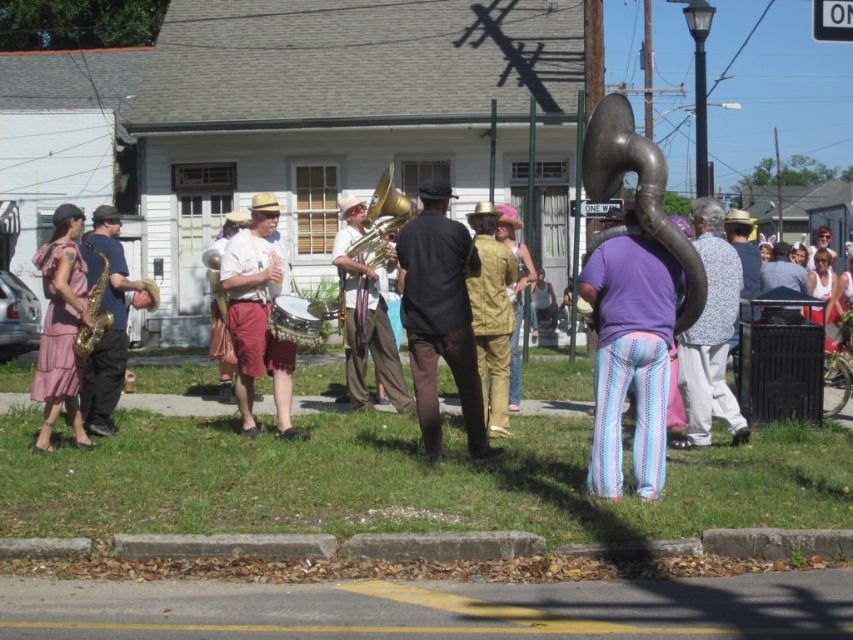
Measure the distance between point (276, 269) and camera.

The distance of point (276, 269) from camera is 10.99 meters.

This screenshot has height=640, width=853. What do you see at coordinates (258, 314) in the screenshot? I see `light brown leather shorts at center` at bounding box center [258, 314].

At what (x,y) coordinates should I click in order to perform the action: click on light brown leather shorts at center. Please return your answer as a coordinate pair (x, y). Looking at the image, I should click on (258, 314).

Based on the photo, how distant is shiny gold tuba at center from gold lacquered saxophone at left?

A distance of 8.35 feet exists between shiny gold tuba at center and gold lacquered saxophone at left.

Does shiny gold tuba at center have a greater width compared to gold lacquered saxophone at left?

Correct, the width of shiny gold tuba at center exceeds that of gold lacquered saxophone at left.

Locate an element on the screen. The image size is (853, 640). shiny gold tuba at center is located at coordinates (366, 314).

Is black matte shirt at center further to the viewer compared to brushed metal drum at center?

No, black matte shirt at center is closer to the viewer.

Locate an element on the screen. The image size is (853, 640). black matte shirt at center is located at coordinates (440, 316).